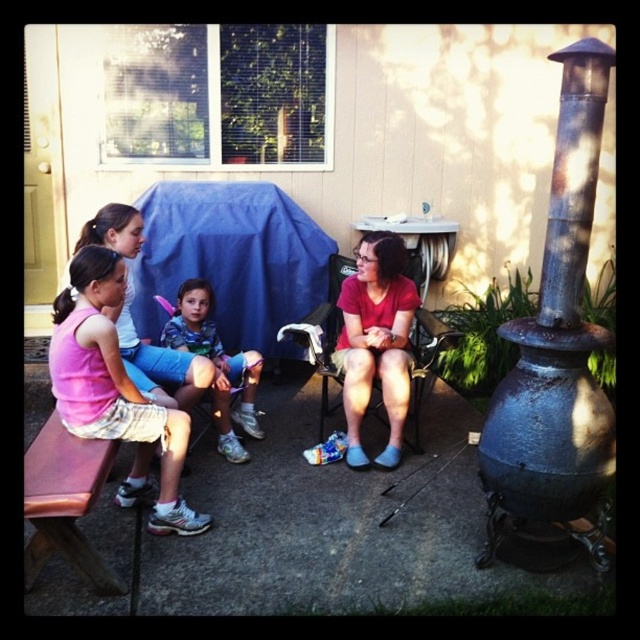
Is the position of brown wooden bench at lower left more distant than that of blue denim shorts at center?

No, brown wooden bench at lower left is in front of blue denim shorts at center.

Is point (90, 476) positioned after point (218, 435)?

No.

Identify the location of brown wooden bench at lower left. This screenshot has width=640, height=640. (65, 502).

Does point (534, 346) come behind point (188, 284)?

No, it is not.

Does rusty metal chimney at right appear on the left side of blue denim shorts at center?

Incorrect, rusty metal chimney at right is not on the left side of blue denim shorts at center.

Is point (604, 109) more distant than point (224, 387)?

No, it is not.

The image size is (640, 640). What are the coordinates of `rusty metal chimney at right` in the screenshot? It's located at (557, 346).

Does point (536, 401) come behind point (388, 461)?

No, (536, 401) is closer to viewer.

Is rusty metal chimney at right wider than matte red shirt at center?

Correct, the width of rusty metal chimney at right exceeds that of matte red shirt at center.

Is point (608, 468) positioned in front of point (416, 307)?

Yes, it is in front of point (416, 307).

Locate an element on the screen. rusty metal chimney at right is located at coordinates (557, 346).